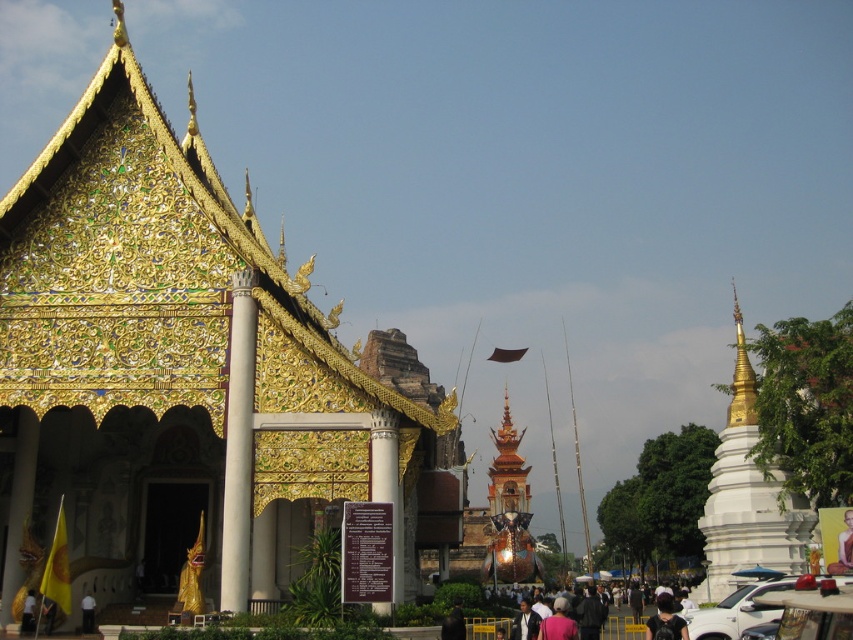
Looking at this image, which is more to the left, white polished stone pillar at center or dark gray fabric at lower left?

dark gray fabric at lower left is more to the left.

Does white polished stone pillar at center have a greater width compared to dark gray fabric at lower left?

Yes, white polished stone pillar at center is wider than dark gray fabric at lower left.

Between point (370, 419) and point (26, 621), which one is positioned in front?

Positioned in front is point (370, 419).

The width and height of the screenshot is (853, 640). Find the location of `white polished stone pillar at center`. white polished stone pillar at center is located at coordinates (387, 484).

Between white metallic car at lower right and dark blue suit at center, which one has less height?

Standing shorter between the two is dark blue suit at center.

Is white metallic car at lower right smaller than dark blue suit at center?

No.

Is point (691, 620) positioned in front of point (523, 627)?

Yes, point (691, 620) is closer to viewer.

This screenshot has height=640, width=853. I want to click on white metallic car at lower right, so click(735, 611).

Can you confirm if dark pink fabric at center is taller than dark gray fabric jacket at center?

Indeed, dark pink fabric at center has a greater height compared to dark gray fabric jacket at center.

Between dark pink fabric at center and dark gray fabric jacket at center, which one has less height?

dark gray fabric jacket at center

Is point (548, 614) farther from viewer compared to point (587, 602)?

No, (548, 614) is closer to viewer.

Where is `dark pink fabric at center`? dark pink fabric at center is located at coordinates (624, 624).